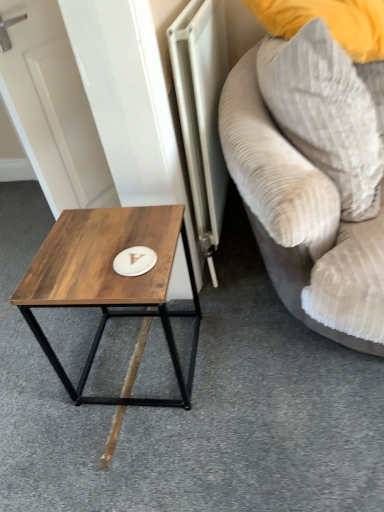
Question: Is wooden table at left smaller than metallic silver radiator at center?

Choices:
 (A) yes
 (B) no

Answer: (A)

Question: Is wooden table at left outside metallic silver radiator at center?

Choices:
 (A) yes
 (B) no

Answer: (A)

Question: Does wooden table at left have a larger size compared to metallic silver radiator at center?

Choices:
 (A) no
 (B) yes

Answer: (A)

Question: From the image's perspective, is wooden table at left above metallic silver radiator at center?

Choices:
 (A) yes
 (B) no

Answer: (B)

Question: Could you tell me if wooden table at left is facing metallic silver radiator at center?

Choices:
 (A) no
 (B) yes

Answer: (A)

Question: Considering the relative sizes of wooden table at left and metallic silver radiator at center in the image provided, is wooden table at left shorter than metallic silver radiator at center?

Choices:
 (A) yes
 (B) no

Answer: (A)

Question: Is gray corduroy pillow at upper right smaller than wooden table at left?

Choices:
 (A) yes
 (B) no

Answer: (B)

Question: Is gray corduroy pillow at upper right closer to camera compared to wooden table at left?

Choices:
 (A) yes
 (B) no

Answer: (A)

Question: Is gray corduroy pillow at upper right at the right side of wooden table at left?

Choices:
 (A) yes
 (B) no

Answer: (A)

Question: Is gray corduroy pillow at upper right positioned behind wooden table at left?

Choices:
 (A) yes
 (B) no

Answer: (B)

Question: Is gray corduroy pillow at upper right outside wooden table at left?

Choices:
 (A) yes
 (B) no

Answer: (A)

Question: Does gray corduroy pillow at upper right have a lesser height compared to wooden table at left?

Choices:
 (A) yes
 (B) no

Answer: (B)

Question: Is wooden table at left taller than velvet beige couch at right?

Choices:
 (A) yes
 (B) no

Answer: (B)